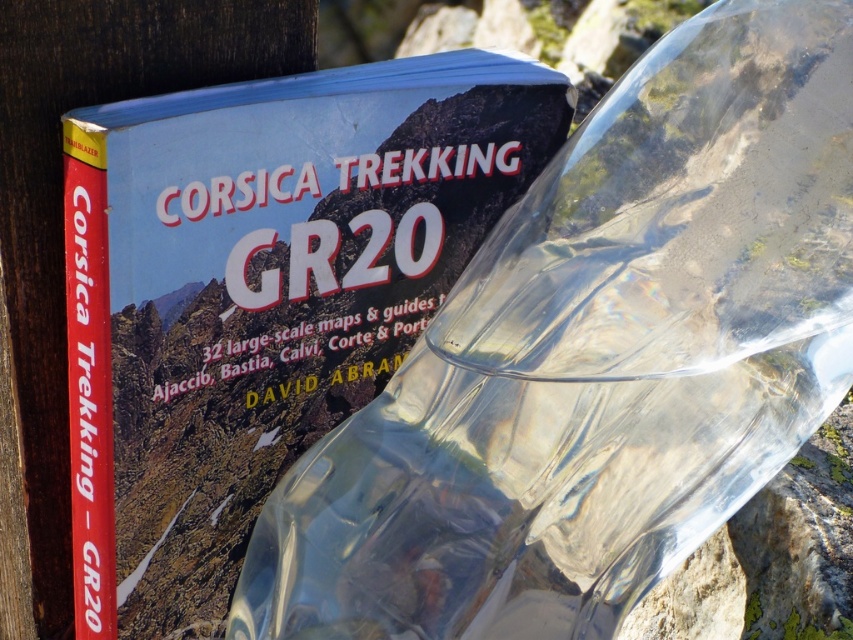
Question: Can you confirm if transparent plastic bottle at center is positioned below matte paper book at center?

Choices:
 (A) yes
 (B) no

Answer: (A)

Question: Is transparent plastic bottle at center smaller than matte paper book at center?

Choices:
 (A) yes
 (B) no

Answer: (A)

Question: Which point is closer to the camera?

Choices:
 (A) (763, 360)
 (B) (80, 276)

Answer: (A)

Question: Is transparent plastic bottle at center below matte paper book at center?

Choices:
 (A) yes
 (B) no

Answer: (A)